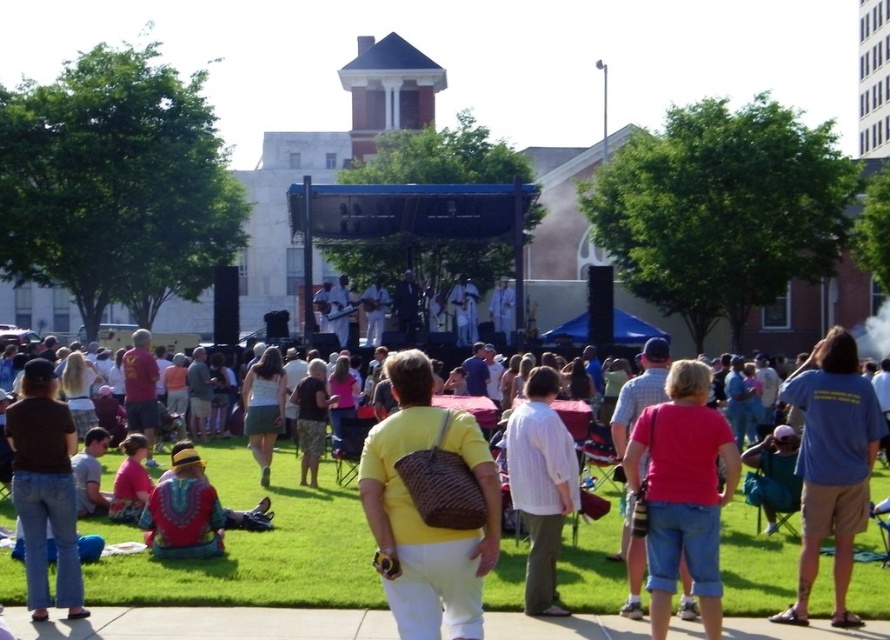
You are a photographer at the park event and want to capture a photo that includes both the blue cotton shirt at right and the brown denim jeans at lower left. Which of the two should you focus on first if you want to ensure both are in frame without moving the camera?

The blue cotton shirt at right is wider than the brown denim jeans at lower left, so focusing on the wider blue cotton shirt at right first would help ensure both are in frame without needing to adjust the camera position.

You are a photographer standing at the camera position. You want to capture a closeup shot of the brown denim jeans at lower left. Considering the distance, is it feasible to take the photo without moving closer?

The brown denim jeans at lower left is 43.57 meters away from the camera. At this distance, capturing a clear closeup shot without moving closer would be challenging unless using a telephoto lens with sufficient zoom capability.

Based on the photo, you are a photographer trying to capture a photo of the white striped shirt at center without including the brown denim jeans at lower left. Given their widths, is this possible?

The brown denim jeans at lower left is wider than the white striped shirt at center. Since the jeans are wider, it might be challenging to frame the photo so that only the shirt is visible without the jeans appearing in the shot, depending on their positions.